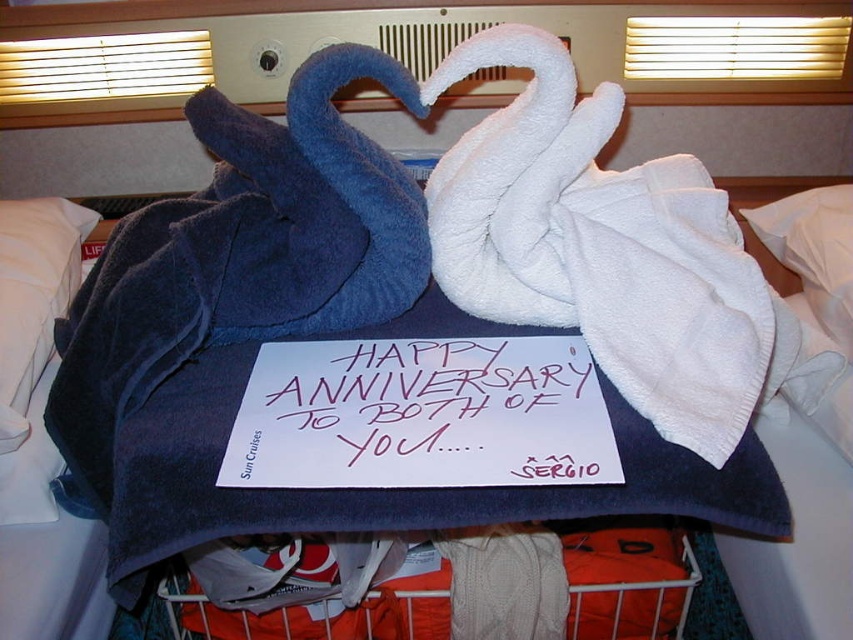
You are a photographer standing at the position of the viewer. You want to take a photo of the orange fabric basket at lower center without moving it. Can you reach it to adjust its position if you have a 75 cm long extendable arm?

The orange fabric basket at lower center and viewer are 78.56 centimeters apart. Since the extendable arm is only 75 cm long, you cannot reach the orange fabric basket at lower center to adjust its position.

You are planning to place a small gift in the orange fabric basket at lower center. To ensure it doesn t fall out, where should you place it relative to the white soft pillow at left?

The orange fabric basket at lower center is located below the white soft pillow at left, so placing the gift inside the orange fabric basket at lower center will keep it secure as it is positioned lower than the white soft pillow at left.